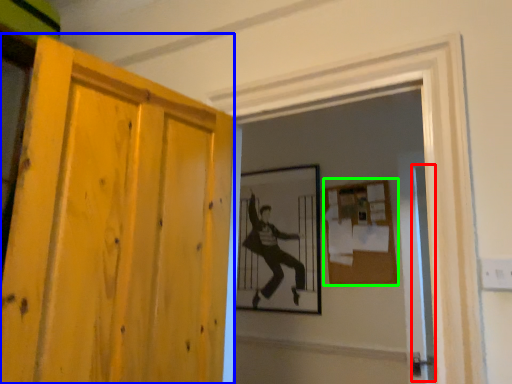
Question: Which is farther away from screen door (highlighted by a red box)? door (highlighted by a blue box) or bulletin board (highlighted by a green box)?

Choices:
 (A) door
 (B) bulletin board

Answer: (A)